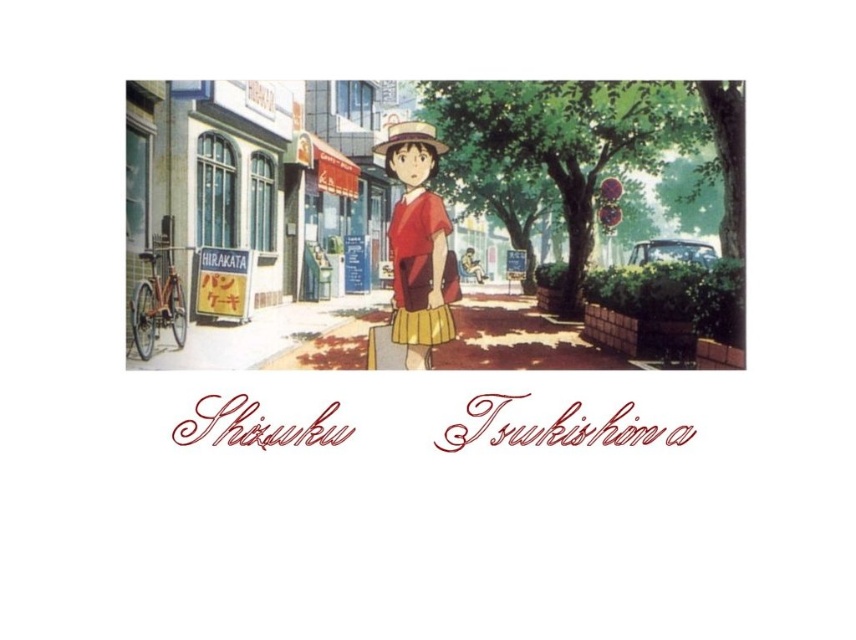
You are a photographer positioned at the camera location. You want to take a photo of the young girl in the scene. The focus point of your camera is set to point (408, 321). Since the focus point is 5.00 meters away from the camera, will the young girl be in focus if she is standing exactly at that point?

Yes, the young girl will be in focus because the focus point at point (408, 321) is set to 5.00 meters from the camera, and if she is standing exactly at that point, the camera will capture her in sharp focus.

What is the location of the point with coordinates (223, 282) in the image?

The point with coordinates (223, 282) is located on the yellow paper sign at left.

You are the girl in the image and you want to move from your current position to the location of the point at (446, 145). Is the point at (232, 248) in front of or behind you as you move towards that location?

The point at (232, 248) is behind the point at (446, 145), so as you move towards the point at (446, 145), the point at (232, 248) will be behind you.